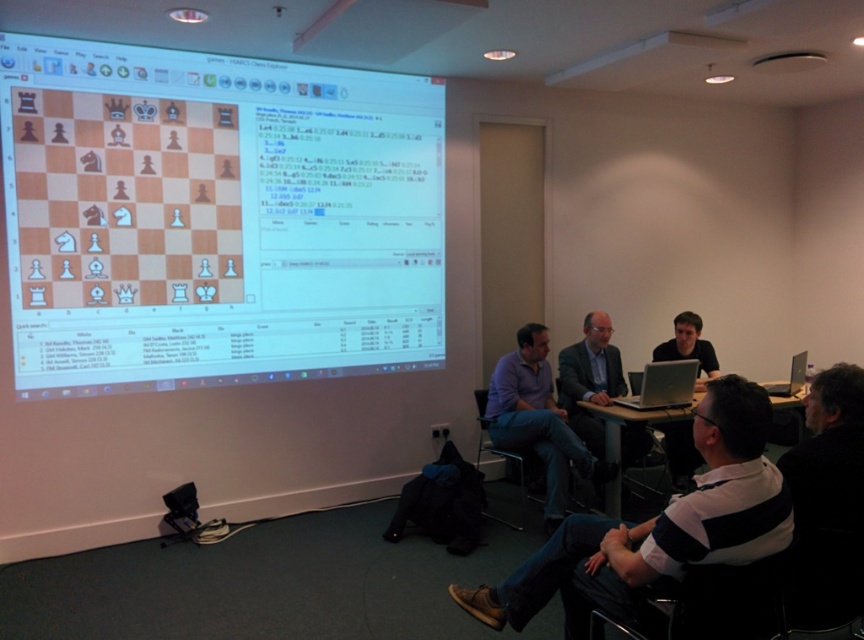
Which is behind, point (504, 417) or point (685, 374)?

Point (504, 417)

The height and width of the screenshot is (640, 864). What do you see at coordinates (537, 419) in the screenshot? I see `purple cotton shirt at center` at bounding box center [537, 419].

You are a GUI agent. You are given a task and a screenshot of the screen. Output one action in this format:
    pyautogui.click(x=<x>, y=<y>)
    Task: Click on the purple cotton shirt at center
    This screenshot has width=864, height=640.
    Given the screenshot: What is the action you would take?
    pyautogui.click(x=537, y=419)

Does white glossy chessboard at upper left lie in front of white striped shirt at lower right?

That is False.

Based on the photo, who is more forward, (29,93) or (642,524)?

Point (642,524)

Which is behind, point (122, 288) or point (748, 513)?

Point (122, 288)

I want to click on white glossy chessboard at upper left, so click(216, 218).

Is point (310, 314) farther from camera compared to point (671, 368)?

Yes, it is behind point (671, 368).

Does white glossy chessboard at upper left have a larger size compared to silver metallic laptop at center?

Yes, white glossy chessboard at upper left is bigger than silver metallic laptop at center.

What do you see at coordinates (216, 218) in the screenshot?
I see `white glossy chessboard at upper left` at bounding box center [216, 218].

Identify the location of white glossy chessboard at upper left. (216, 218).